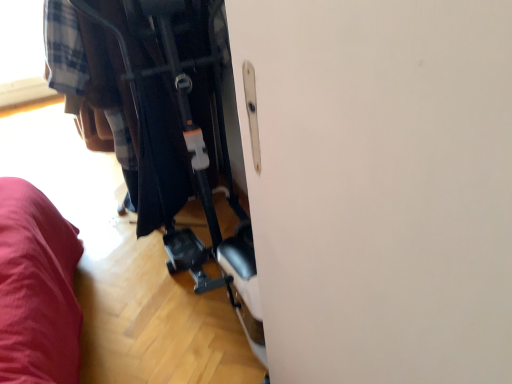
Image resolution: width=512 pixels, height=384 pixels. I want to click on plaid fabric at center, so click(x=119, y=110).

What do you see at coordinates (119, 110) in the screenshot? I see `plaid fabric at center` at bounding box center [119, 110].

Locate an element on the screen. Image resolution: width=512 pixels, height=384 pixels. metallic black baby carriage at center is located at coordinates (170, 130).

Looking at this image, in order to face metallic black baby carriage at center, should I rotate leftwards or rightwards?

To align with it, rotate left about 6.078°.

The height and width of the screenshot is (384, 512). What do you see at coordinates (170, 130) in the screenshot?
I see `metallic black baby carriage at center` at bounding box center [170, 130].

Identify the location of plaid fabric at center. (119, 110).

Between metallic black baby carriage at center and plaid fabric at center, which one appears on the left side from the viewer's perspective?

From the viewer's perspective, plaid fabric at center appears more on the left side.

Which object is closer to the camera, metallic black baby carriage at center or plaid fabric at center?

Positioned in front is metallic black baby carriage at center.

Which is behind, point (176, 14) or point (47, 57)?

The point (47, 57) is more distant.

From the image's perspective, does metallic black baby carriage at center appear lower than plaid fabric at center?

Yes.

From a real-world perspective, is metallic black baby carriage at center positioned above or below plaid fabric at center?

metallic black baby carriage at center is situated higher than plaid fabric at center in the real world.

In the scene shown: Considering the sizes of metallic black baby carriage at center and plaid fabric at center in the image, is metallic black baby carriage at center wider or thinner than plaid fabric at center?

Clearly, metallic black baby carriage at center has more width compared to plaid fabric at center.

Considering the sizes of objects metallic black baby carriage at center and plaid fabric at center in the image provided, who is shorter, metallic black baby carriage at center or plaid fabric at center?

plaid fabric at center is shorter.

Considering the sizes of objects metallic black baby carriage at center and plaid fabric at center in the image provided, who is smaller, metallic black baby carriage at center or plaid fabric at center?

Smaller between the two is plaid fabric at center.

Do you think metallic black baby carriage at center is within plaid fabric at center, or outside of it?

metallic black baby carriage at center is not enclosed by plaid fabric at center.

In the scene shown: Is metallic black baby carriage at center placed right next to plaid fabric at center?

No, metallic black baby carriage at center is not with plaid fabric at center.

Is metallic black baby carriage at center aimed at plaid fabric at center?

Yes, metallic black baby carriage at center faces towards plaid fabric at center.

Measure the distance from metallic black baby carriage at center to plaid fabric at center.

metallic black baby carriage at center is 4.35 inches away from plaid fabric at center.

The height and width of the screenshot is (384, 512). Identify the location of clothing behind the metallic black baby carriage at center. (119, 110).

Considering the relative positions of plaid fabric at center and metallic black baby carriage at center in the image provided, is plaid fabric at center to the left or to the right of metallic black baby carriage at center?

Clearly, plaid fabric at center is on the left of metallic black baby carriage at center in the image.

Which object is further away from the camera taking this photo, plaid fabric at center or metallic black baby carriage at center?

plaid fabric at center.

Considering the positions of point (147, 62) and point (189, 24), is point (147, 62) closer or farther from the camera than point (189, 24)?

Point (147, 62).

From the image's perspective, is plaid fabric at center above metallic black baby carriage at center?

Yes, from the image's perspective, plaid fabric at center is above metallic black baby carriage at center.

From a real-world perspective, is plaid fabric at center over metallic black baby carriage at center?

No.

Between plaid fabric at center and metallic black baby carriage at center, which one has larger width?

metallic black baby carriage at center is wider.

Is plaid fabric at center shorter than metallic black baby carriage at center?

Yes.

Considering the sizes of objects plaid fabric at center and metallic black baby carriage at center in the image provided, who is bigger, plaid fabric at center or metallic black baby carriage at center?

With larger size is metallic black baby carriage at center.

Consider the image. Is plaid fabric at center spatially inside metallic black baby carriage at center, or outside of it?

plaid fabric at center is not enclosed by metallic black baby carriage at center.

Can you see plaid fabric at center touching metallic black baby carriage at center?

plaid fabric at center is not next to metallic black baby carriage at center, and they're not touching.

Is plaid fabric at center aimed at metallic black baby carriage at center?

No, plaid fabric at center does not turn towards metallic black baby carriage at center.

This screenshot has width=512, height=384. Find the location of `clothing behind the metallic black baby carriage at center`. clothing behind the metallic black baby carriage at center is located at coordinates (119, 110).

Find the location of a particular element. This screenshot has height=384, width=512. clothing on the left of metallic black baby carriage at center is located at coordinates (119, 110).

Identify the location of baby carriage positioned vertically above the plaid fabric at center (from a real-world perspective). This screenshot has height=384, width=512. (170, 130).